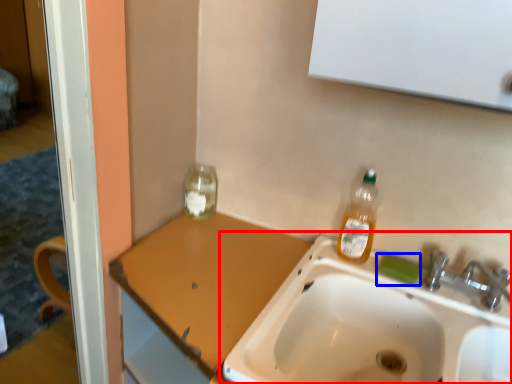
Question: Which object is further to the camera taking this photo, sink (highlighted by a red box) or soap (highlighted by a blue box)?

Choices:
 (A) sink
 (B) soap

Answer: (B)